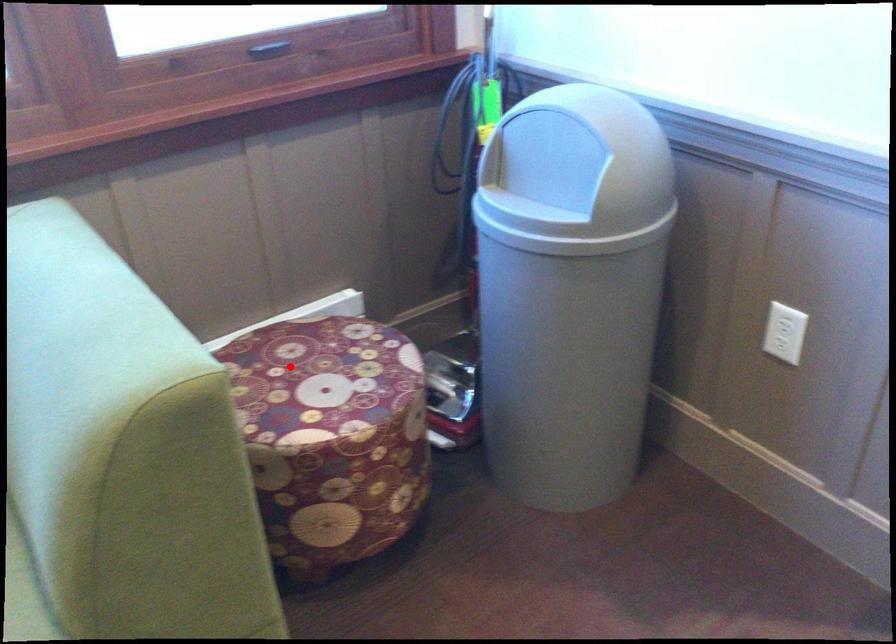
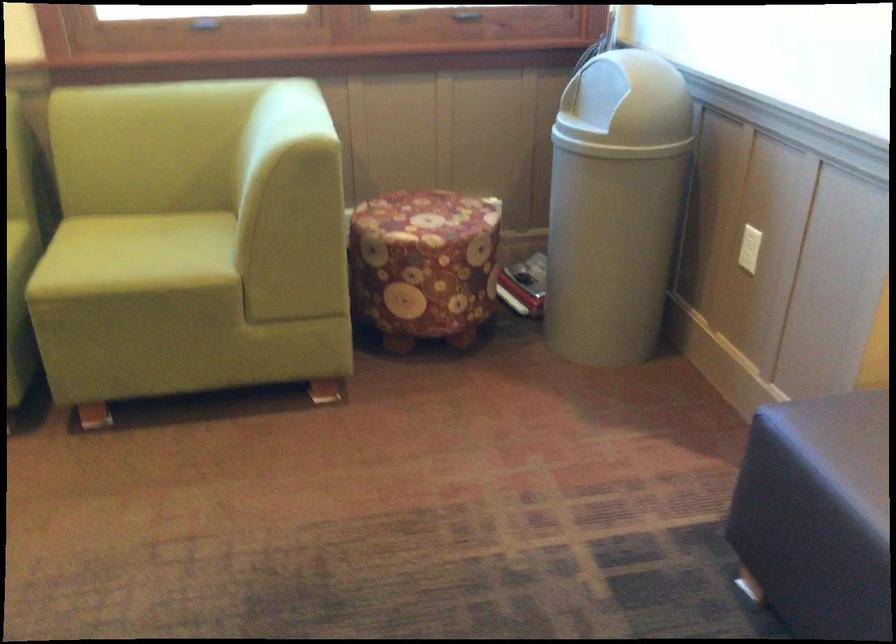
Question: I am providing you with two images of the same scene from different viewpoints. Given a red point in image1, look at the same physical point in image2. Is it:

Choices:
 (A) Closer to the viewpoint
 (B) Farther from the viewpoint

Answer: (B)